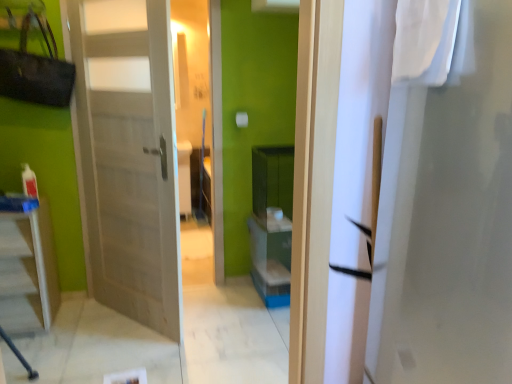
Question: From the image's perspective, would you say wooden door at left is shown under white glossy table at lower left?

Choices:
 (A) no
 (B) yes

Answer: (A)

Question: Is wooden door at left to the left of white glossy table at lower left from the viewer's perspective?

Choices:
 (A) yes
 (B) no

Answer: (B)

Question: Could white glossy table at lower left be considered to be inside wooden door at left?

Choices:
 (A) no
 (B) yes

Answer: (A)

Question: Is white glossy table at lower left at the back of wooden door at left?

Choices:
 (A) no
 (B) yes

Answer: (A)

Question: Does wooden door at left have a greater height compared to white glossy table at lower left?

Choices:
 (A) no
 (B) yes

Answer: (B)

Question: Considering the positions of white glossy table at lower left and wooden door at left in the image, is white glossy table at lower left bigger or smaller than wooden door at left?

Choices:
 (A) small
 (B) big

Answer: (A)

Question: In terms of height, does white glossy table at lower left look taller or shorter compared to wooden door at left?

Choices:
 (A) short
 (B) tall

Answer: (A)

Question: Is white glossy table at lower left inside or outside of wooden door at left?

Choices:
 (A) inside
 (B) outside

Answer: (B)

Question: From a real-world perspective, is white glossy table at lower left above or below wooden door at left?

Choices:
 (A) above
 (B) below

Answer: (B)

Question: Based on their positions, is white glossy table at lower left located to the left or right of white fabric at upper right?

Choices:
 (A) left
 (B) right

Answer: (A)

Question: Is point (27, 311) positioned closer to the camera than point (404, 51)?

Choices:
 (A) farther
 (B) closer

Answer: (A)

Question: Relative to white fabric at upper right, is white glossy table at lower left in front or behind?

Choices:
 (A) behind
 (B) front

Answer: (A)

Question: Looking at the image, does white glossy table at lower left seem bigger or smaller compared to white fabric at upper right?

Choices:
 (A) small
 (B) big

Answer: (B)

Question: Is wooden door at left wider or thinner than white glossy table at lower left?

Choices:
 (A) wide
 (B) thin

Answer: (B)

Question: Based on their sizes in the image, would you say wooden door at left is bigger or smaller than white glossy table at lower left?

Choices:
 (A) small
 (B) big

Answer: (B)